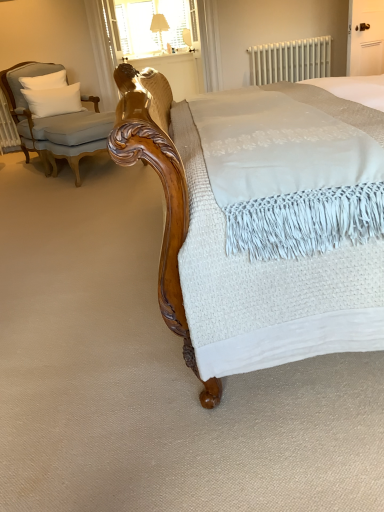
Question: Visually, is white soft cushion at upper left positioned to the left or to the right of white fabric at upper center?

Choices:
 (A) right
 (B) left

Answer: (B)

Question: From a real-world perspective, is white soft cushion at upper left above or below white fabric at upper center?

Choices:
 (A) below
 (B) above

Answer: (A)

Question: Estimate the real-world distances between objects in this image. Which object is farther from the white fabric at upper center?

Choices:
 (A) light gray fabric chair at left
 (B) wooden balustrade at upper center
 (C) white soft cushion at upper left
 (D) matte cream fabric table lamp at upper center
 (E) white metallic radiator at upper center

Answer: (A)

Question: Based on their relative distances, which object is farther from the white metallic radiator at upper center?

Choices:
 (A) wooden balustrade at upper center
 (B) matte cream fabric table lamp at upper center
 (C) light gray fabric chair at left
 (D) white soft cushion at upper left
 (E) white fabric at upper center

Answer: (C)